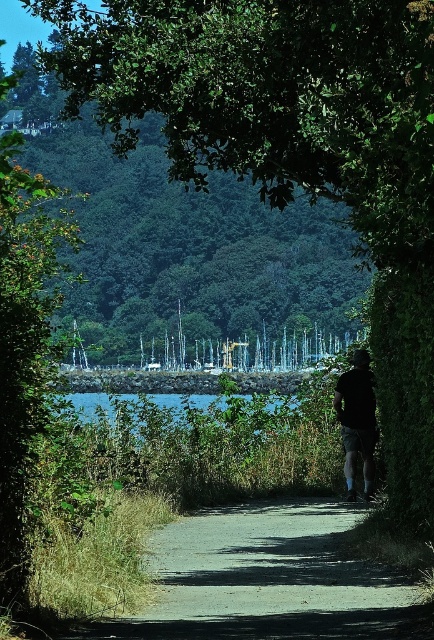
Can you confirm if gray gravel path at center is positioned to the right of black cotton shirt at center?

No, gray gravel path at center is not to the right of black cotton shirt at center.

Does gray gravel path at center have a greater height compared to black cotton shirt at center?

Incorrect, gray gravel path at center's height is not larger of black cotton shirt at center's.

Describe the element at coordinates (268, 580) in the screenshot. I see `gray gravel path at center` at that location.

Find the location of a particular element. gray gravel path at center is located at coordinates (268, 580).

How far apart are gray gravel path at center and blue water at center?

gray gravel path at center and blue water at center are 8.28 meters apart.

Between point (214, 515) and point (97, 410), which one is positioned behind?

The point (97, 410) is behind.

At what (x,y) coordinates should I click in order to perform the action: click on gray gravel path at center. Please return your answer as a coordinate pair (x, y). The height and width of the screenshot is (640, 434). Looking at the image, I should click on (268, 580).

Which is above, black cotton shirt at center or blue water at center?

black cotton shirt at center is above.

Who is lower down, black cotton shirt at center or blue water at center?

blue water at center is lower down.

The width and height of the screenshot is (434, 640). Describe the element at coordinates (357, 420) in the screenshot. I see `black cotton shirt at center` at that location.

At what (x,y) coordinates should I click in order to perform the action: click on black cotton shirt at center. Please return your answer as a coordinate pair (x, y). The height and width of the screenshot is (640, 434). Looking at the image, I should click on (357, 420).